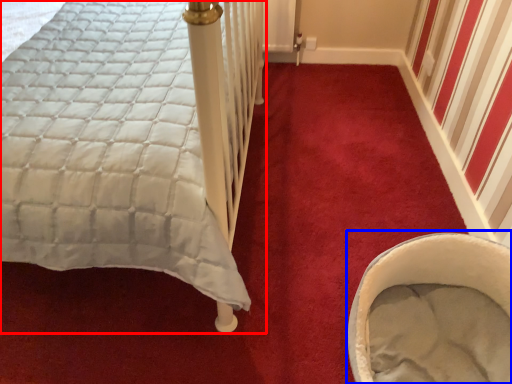
Question: Which object appears closest to the camera in this image, bed (highlighted by a red box) or baby carriage (highlighted by a blue box)?

Choices:
 (A) bed
 (B) baby carriage

Answer: (A)